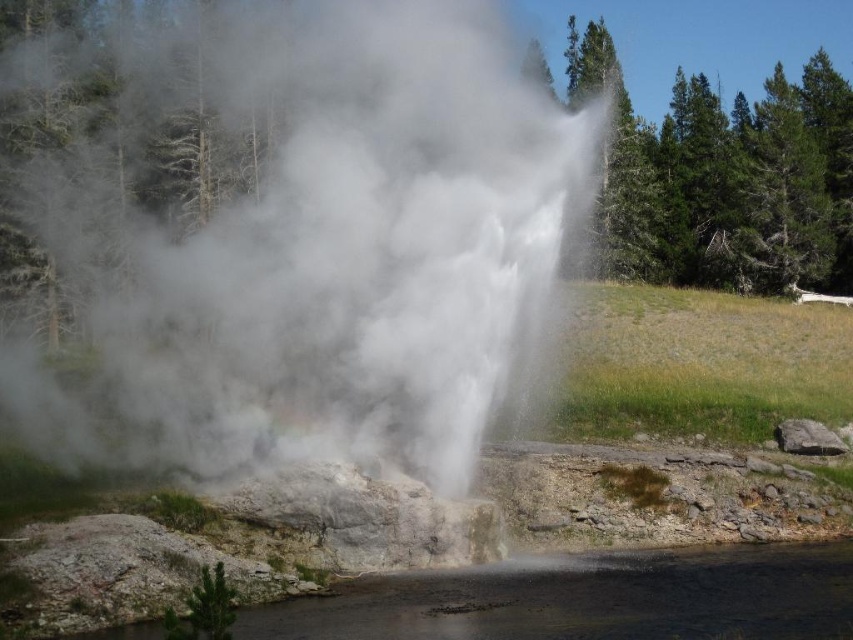
Question: Among these objects, which one is farthest from the camera?

Choices:
 (A) white vapor at center
 (B) clear water at lower center

Answer: (A)

Question: Among these objects, which one is farthest from the camera?

Choices:
 (A) white vapor at center
 (B) clear water at lower center

Answer: (A)

Question: Considering the relative positions of white vapor at center and clear water at lower center in the image provided, where is white vapor at center located with respect to clear water at lower center?

Choices:
 (A) above
 (B) below

Answer: (A)

Question: Is white vapor at center bigger than clear water at lower center?

Choices:
 (A) yes
 (B) no

Answer: (A)

Question: Does white vapor at center appear under clear water at lower center?

Choices:
 (A) no
 (B) yes

Answer: (A)